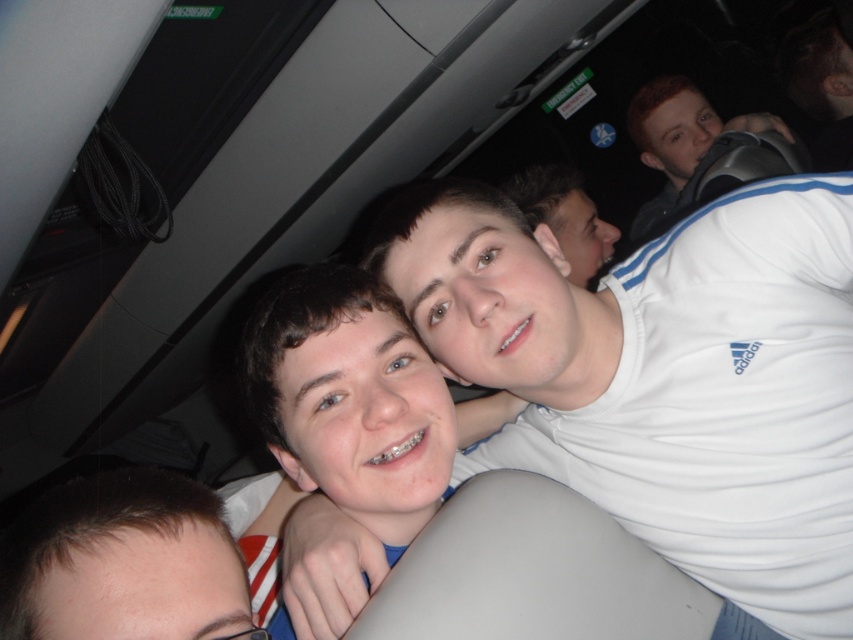
Question: Based on their relative distances, which object is nearer to the white matte shirt at center?

Choices:
 (A) smooth skin face at center
 (B) matte black backpack at upper right
 (C) brown hair at lower left

Answer: (A)

Question: Which point is closer to the camera taking this photo?

Choices:
 (A) (358, 404)
 (B) (693, 182)
 (C) (792, 259)
 (D) (138, 540)

Answer: (D)

Question: Can you confirm if smooth skin face at center is smaller than brown hair at lower left?

Choices:
 (A) no
 (B) yes

Answer: (A)

Question: Does smooth skin face at center appear on the left side of matte black backpack at upper right?

Choices:
 (A) yes
 (B) no

Answer: (A)

Question: Which point appears closest to the camera in this image?

Choices:
 (A) (699, 292)
 (B) (688, 97)
 (C) (210, 557)

Answer: (C)

Question: Does smooth skin face at center have a smaller size compared to matte black backpack at upper right?

Choices:
 (A) yes
 (B) no

Answer: (A)